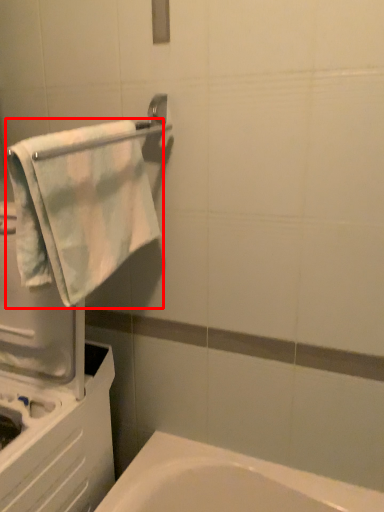
Question: From the image's perspective, where is towel (annotated by the red box) located in relation to towel bar in the image?

Choices:
 (A) below
 (B) above

Answer: (A)